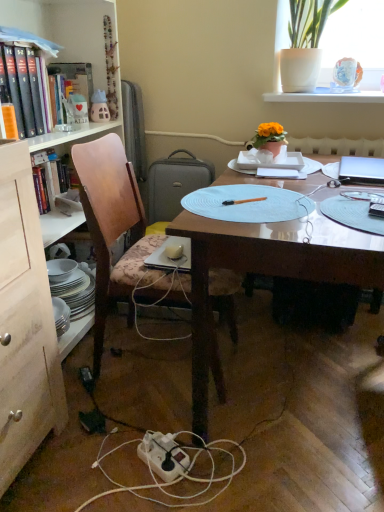
Question: From the image's perspective, is orange matte book at left, marked as the second book in a back-to-front arrangement, positioned above or below white plastic power outlet at lower center?

Choices:
 (A) below
 (B) above

Answer: (B)

Question: Is orange matte book at left, marked as the second book in a back-to-front arrangement, bigger or smaller than white plastic power outlet at lower center?

Choices:
 (A) big
 (B) small

Answer: (A)

Question: Estimate the real-world distances between objects in this image. Which object is farther from the white plastic power plugs and sockets at lower center, which appears as the 1th power plugs and sockets when viewed from the front?

Choices:
 (A) matte plastic cup at upper left, which is counted as the second book, starting from the front
 (B) silver metallic laptop at upper right
 (C) matte plastic toy house at upper left
 (D) black plastic power plugs and sockets at lower left, the 2th power plugs and sockets from the front
 (E) orange matte book at left, marked as the second book in a back-to-front arrangement

Answer: (A)

Question: Which object is the closest to the wooden bookcase at left?

Choices:
 (A) wooden desk at center
 (B) black plastic power plugs and sockets at lower left, which is counted as the 2th power plugs and sockets, starting from the bottom
 (C) white ceramic pot at upper right
 (D) matte plastic cup at upper left, which is the 1th book from back to front
 (E) white plastic power outlet at lower center

Answer: (D)